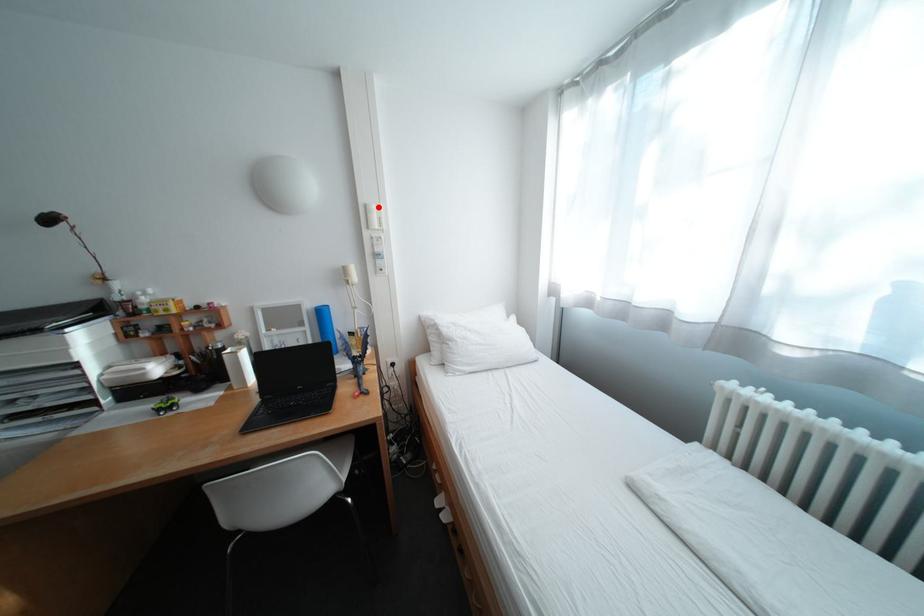
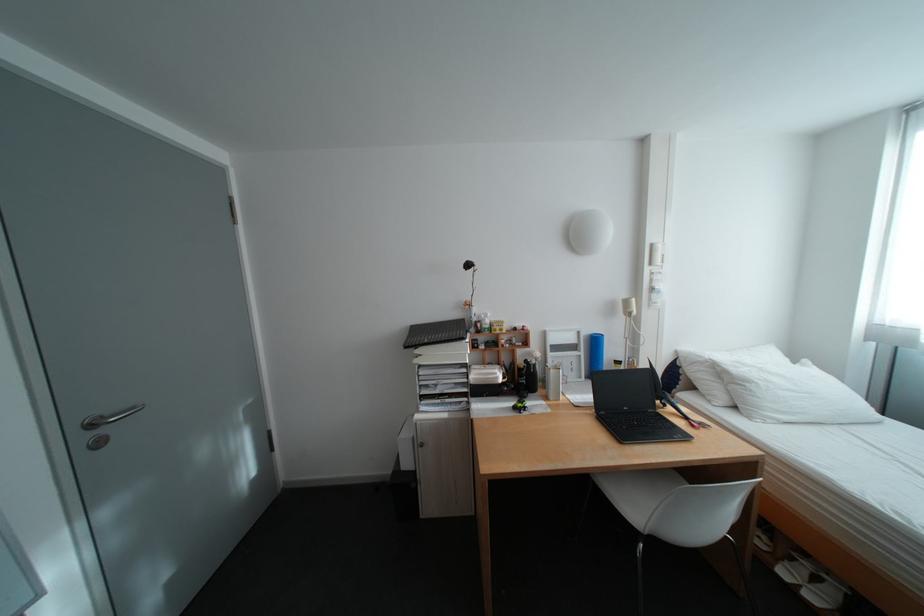
Question: I am providing you with two images of the same scene from different viewpoints. A red point is shown in image1. For the corresponding object point in image2, is it positioned nearer or farther from the camera?

Choices:
 (A) Nearer
 (B) Farther

Answer: (B)